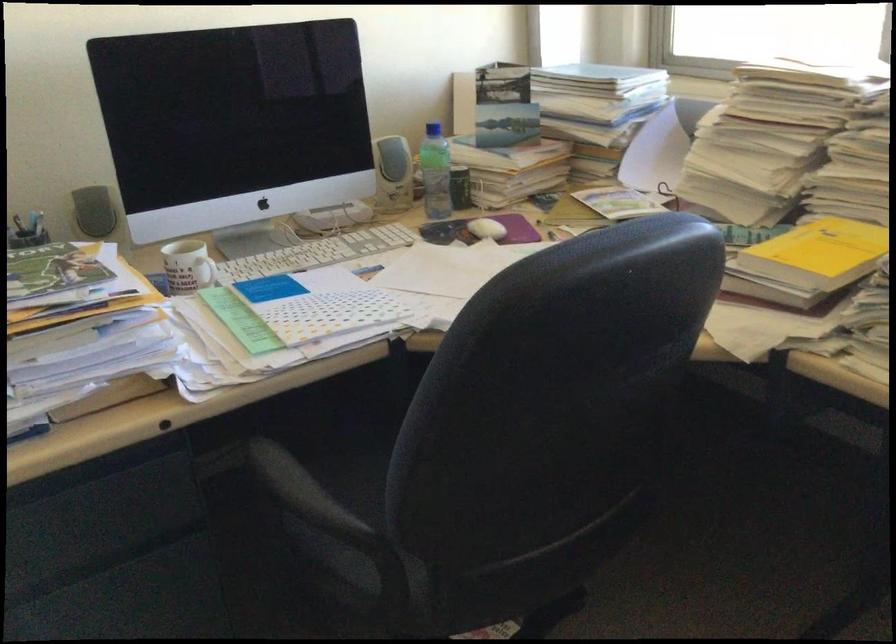
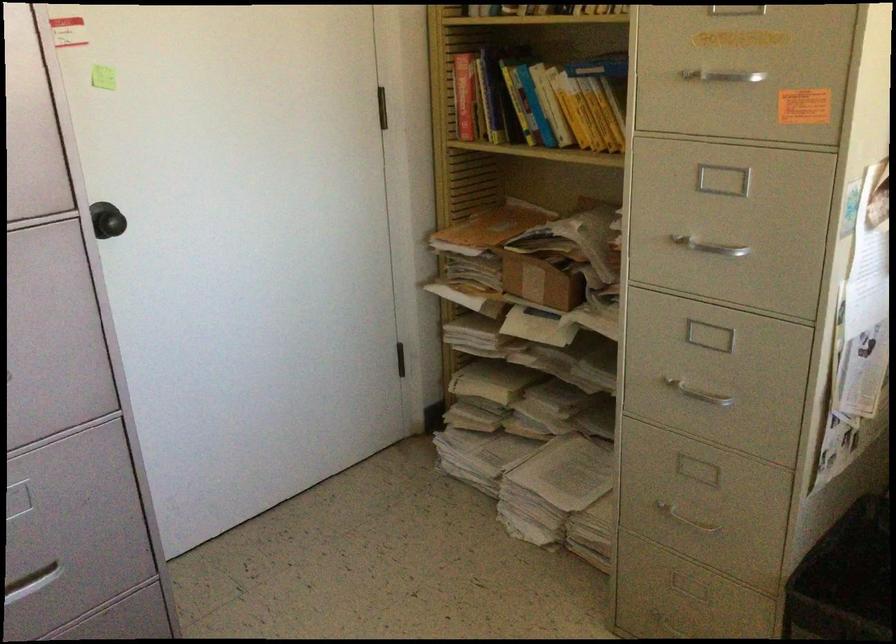
The images are taken continuously from a first-person perspective. In which direction is your viewpoint rotating?

The rotation direction of the camera is left-down.